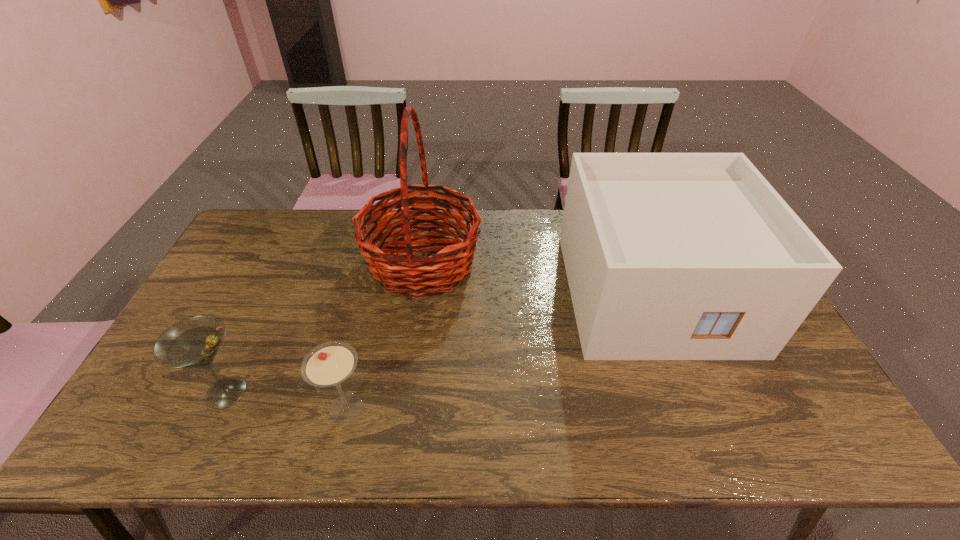
Find the location of a particular element. This screenshot has width=960, height=540. vacant space located on the right of the right martini is located at coordinates (495, 408).

Image resolution: width=960 pixels, height=540 pixels. I want to click on basket present at the far edge, so click(x=406, y=273).

Locate an element on the screen. The height and width of the screenshot is (540, 960). box located at the far edge is located at coordinates (669, 256).

Identify the location of object that is positioned at the left edge. The width and height of the screenshot is (960, 540). (193, 342).

At what (x,y) coordinates should I click in order to perform the action: click on object located at the right edge. Please return your answer as a coordinate pair (x, y). Looking at the image, I should click on (669, 256).

The height and width of the screenshot is (540, 960). In order to click on object that is at the near left corner in this screenshot , I will do `click(193, 342)`.

Find the location of a particular element. This screenshot has width=960, height=540. object that is at the far right corner is located at coordinates (669, 256).

This screenshot has width=960, height=540. What are the coordinates of `free region at the far edge` in the screenshot? It's located at (558, 210).

Where is `blank area at the near edge`? The image size is (960, 540). blank area at the near edge is located at coordinates (566, 444).

Image resolution: width=960 pixels, height=540 pixels. In order to click on blank space at the left edge in this screenshot , I will do `click(249, 296)`.